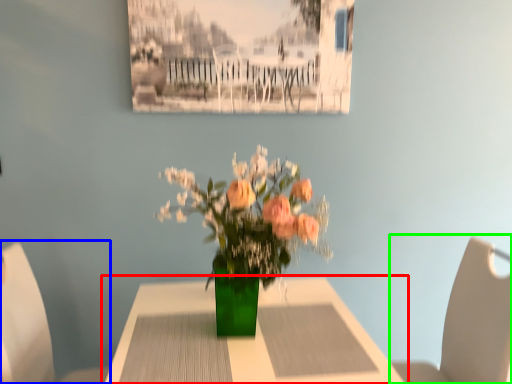
Question: Which is nearer to the table (highlighted by a red box)? chair (highlighted by a blue box) or chair (highlighted by a green box).

Choices:
 (A) chair
 (B) chair

Answer: (A)